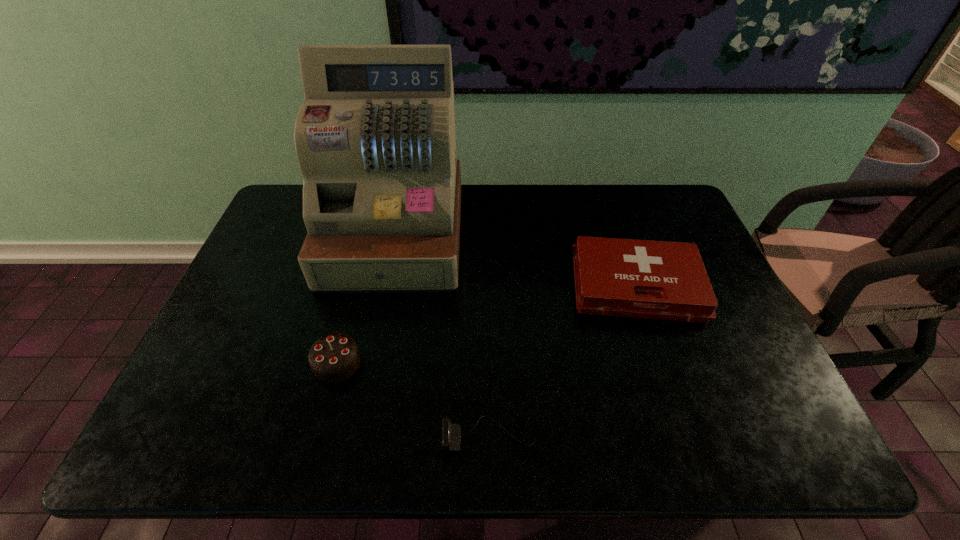
Where is `vacant area in the image that satisfies the following two spatial constraints: 1. on the back side of the rightmost object; 2. on the left side of the chocolate cake`? Image resolution: width=960 pixels, height=540 pixels. vacant area in the image that satisfies the following two spatial constraints: 1. on the back side of the rightmost object; 2. on the left side of the chocolate cake is located at coordinates (357, 286).

Identify the location of vacant area in the image that satisfies the following two spatial constraints: 1. on the front side of the first-aid kit; 2. on the front-facing side of the shortest object. The height and width of the screenshot is (540, 960). (686, 436).